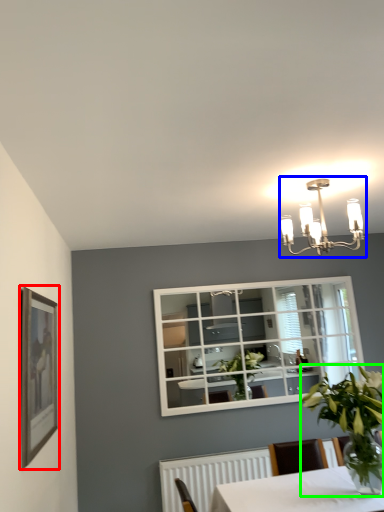
Question: Which is nearer to the picture frame (highlighted by a red box)? lamp (highlighted by a blue box) or houseplant (highlighted by a green box).

Choices:
 (A) lamp
 (B) houseplant

Answer: (B)